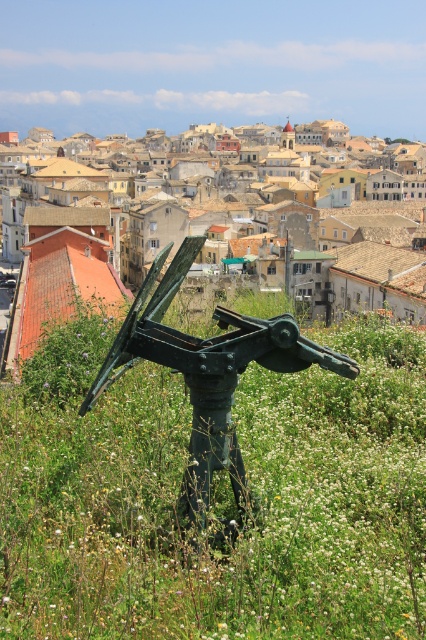
Question: Where is green grassy at center located in relation to green metal sculpture at center in the image?

Choices:
 (A) left
 (B) right

Answer: (B)

Question: Is green grassy at center wider than green metal sculpture at center?

Choices:
 (A) yes
 (B) no

Answer: (A)

Question: In this image, where is green grassy at center located relative to green metal sculpture at center?

Choices:
 (A) right
 (B) left

Answer: (A)